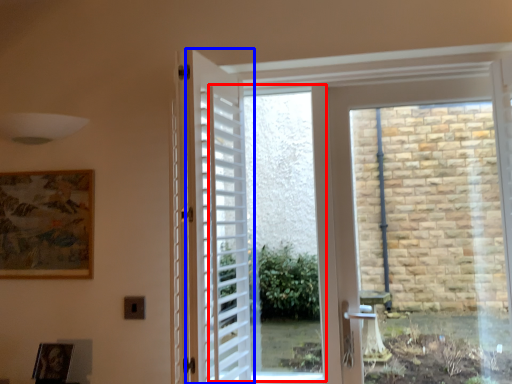
Question: Among these objects, which one is nearest to the camera, window screen (highlighted by a red box) or door (highlighted by a blue box)?

Choices:
 (A) window screen
 (B) door

Answer: (B)